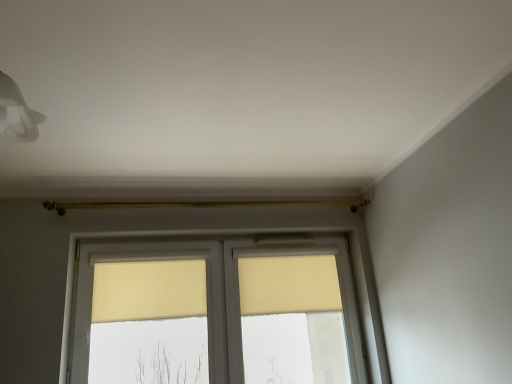
The image size is (512, 384). What do you see at coordinates (216, 313) in the screenshot?
I see `matte yellow window at center` at bounding box center [216, 313].

What do you see at coordinates (149, 290) in the screenshot?
I see `beige fabric curtain at center, the first curtain when ordered from left to right` at bounding box center [149, 290].

I want to click on beige fabric curtain at center, the first curtain when ordered from right to left, so click(x=288, y=285).

Image resolution: width=512 pixels, height=384 pixels. Identify the location of matte yellow window at center. (216, 313).

Could you tell me if beige fabric curtain at center, the first curtain when ordered from right to left, is facing matte yellow window at center?

Yes, beige fabric curtain at center, the first curtain when ordered from right to left, is oriented towards matte yellow window at center.

How far apart are beige fabric curtain at center, the second curtain from the left, and matte yellow window at center?

beige fabric curtain at center, the second curtain from the left, and matte yellow window at center are 6.68 inches apart.

Does beige fabric curtain at center, the first curtain when ordered from right to left, have a larger size compared to matte yellow window at center?

Incorrect, beige fabric curtain at center, the first curtain when ordered from right to left, is not larger than matte yellow window at center.

From a real-world perspective, is beige fabric curtain at center, the first curtain when ordered from right to left, located higher than matte yellow window at center?

Yes, from a real-world perspective, beige fabric curtain at center, the first curtain when ordered from right to left, is over matte yellow window at center

How far apart are beige fabric curtain at center, the first curtain when ordered from left to right, and beige fabric curtain at center, the second curtain from the left?

beige fabric curtain at center, the first curtain when ordered from left to right, is 21.47 inches from beige fabric curtain at center, the second curtain from the left.

Considering the sizes of objects beige fabric curtain at center, the first curtain when ordered from left to right, and beige fabric curtain at center, the first curtain when ordered from right to left, in the image provided, who is shorter, beige fabric curtain at center, the first curtain when ordered from left to right, or beige fabric curtain at center, the first curtain when ordered from right to left,?

beige fabric curtain at center, the first curtain when ordered from left to right.

Between beige fabric curtain at center, acting as the 2th curtain starting from the right, and beige fabric curtain at center, the second curtain from the left, which one is positioned behind?

beige fabric curtain at center, the second curtain from the left.

Can you tell me how much beige fabric curtain at center, acting as the 2th curtain starting from the right, and beige fabric curtain at center, the second curtain from the left, differ in facing direction?

The angle between the facing direction of beige fabric curtain at center, acting as the 2th curtain starting from the right, and the facing direction of beige fabric curtain at center, the second curtain from the left, is 0.00625 degrees.

From a real-world perspective, relative to beige fabric curtain at center, the second curtain from the left, is matte yellow window at center vertically above or below?

matte yellow window at center is situated lower than beige fabric curtain at center, the second curtain from the left, in the real world.

Does matte yellow window at center have a lesser width compared to beige fabric curtain at center, the first curtain when ordered from right to left?

No.

Is matte yellow window at center not close to beige fabric curtain at center, the first curtain when ordered from right to left?

matte yellow window at center is near beige fabric curtain at center, the first curtain when ordered from right to left, not far away.

Does matte yellow window at center lie behind beige fabric curtain at center, the second curtain from the left?

No, matte yellow window at center is closer to the viewer.

Looking at this image, considering the sizes of objects beige fabric curtain at center, the first curtain when ordered from right to left, and beige fabric curtain at center, acting as the 2th curtain starting from the right, in the image provided, who is taller, beige fabric curtain at center, the first curtain when ordered from right to left, or beige fabric curtain at center, acting as the 2th curtain starting from the right,?

Standing taller between the two is beige fabric curtain at center, the first curtain when ordered from right to left.

In the scene shown: Is beige fabric curtain at center, the first curtain when ordered from right to left, surrounding beige fabric curtain at center, acting as the 2th curtain starting from the right?

Actually, beige fabric curtain at center, acting as the 2th curtain starting from the right, is outside beige fabric curtain at center, the first curtain when ordered from right to left.

Which is behind, point (309, 300) or point (136, 267)?

Point (309, 300)

Which object is positioned more to the left, beige fabric curtain at center, the first curtain when ordered from right to left, or beige fabric curtain at center, the first curtain when ordered from left to right?

From the viewer's perspective, beige fabric curtain at center, the first curtain when ordered from left to right, appears more on the left side.

Image resolution: width=512 pixels, height=384 pixels. I want to click on window that appears below the beige fabric curtain at center, the first curtain when ordered from left to right (from a real-world perspective), so click(216, 313).

Does matte yellow window at center turn towards beige fabric curtain at center, the first curtain when ordered from left to right?

Yes, matte yellow window at center is aimed at beige fabric curtain at center, the first curtain when ordered from left to right.

Consider the image. From a real-world perspective, is matte yellow window at center positioned above or below beige fabric curtain at center, acting as the 2th curtain starting from the right?

matte yellow window at center is situated lower than beige fabric curtain at center, acting as the 2th curtain starting from the right, in the real world.

Looking at this image, which object is positioned more to the right, beige fabric curtain at center, acting as the 2th curtain starting from the right, or matte yellow window at center?

From the viewer's perspective, matte yellow window at center appears more on the right side.

Which is nearer, (126, 298) or (281, 277)?

Point (126, 298) appears to be closer to the viewer than point (281, 277).

Considering the sizes of beige fabric curtain at center, the first curtain when ordered from left to right, and matte yellow window at center in the image, is beige fabric curtain at center, the first curtain when ordered from left to right, wider or thinner than matte yellow window at center?

Clearly, beige fabric curtain at center, the first curtain when ordered from left to right, has less width compared to matte yellow window at center.

Considering the positions of objects beige fabric curtain at center, acting as the 2th curtain starting from the right, and matte yellow window at center in the image provided, who is behind, beige fabric curtain at center, acting as the 2th curtain starting from the right, or matte yellow window at center?

beige fabric curtain at center, acting as the 2th curtain starting from the right, is further away from the camera.

Locate an element on the screen. This screenshot has height=384, width=512. window below the beige fabric curtain at center, the first curtain when ordered from right to left (from a real-world perspective) is located at coordinates (216, 313).

You are a GUI agent. You are given a task and a screenshot of the screen. Output one action in this format:
    pyautogui.click(x=<x>, y=<y>)
    Task: Click on the curtain that appears behind the beige fabric curtain at center, the first curtain when ordered from left to right
    This screenshot has height=384, width=512.
    Given the screenshot: What is the action you would take?
    pyautogui.click(x=288, y=285)

Estimate the real-world distances between objects in this image. Which object is further from matte yellow window at center, beige fabric curtain at center, the second curtain from the left, or beige fabric curtain at center, acting as the 2th curtain starting from the right?

beige fabric curtain at center, acting as the 2th curtain starting from the right, is further to matte yellow window at center.

When comparing their distances from beige fabric curtain at center, the first curtain when ordered from left to right, does matte yellow window at center or beige fabric curtain at center, the first curtain when ordered from right to left, seem further?

The object further to beige fabric curtain at center, the first curtain when ordered from left to right, is beige fabric curtain at center, the first curtain when ordered from right to left.

Consider the image. From the image, which object appears to be farther from beige fabric curtain at center, the first curtain when ordered from right to left, beige fabric curtain at center, the first curtain when ordered from left to right, or matte yellow window at center?

beige fabric curtain at center, the first curtain when ordered from left to right.

Estimate the real-world distances between objects in this image. Which object is further from beige fabric curtain at center, acting as the 2th curtain starting from the right, beige fabric curtain at center, the first curtain when ordered from right to left, or matte yellow window at center?

Based on the image, beige fabric curtain at center, the first curtain when ordered from right to left, appears to be further to beige fabric curtain at center, acting as the 2th curtain starting from the right.

Looking at the image, which one is located closer to beige fabric curtain at center, the first curtain when ordered from right to left, matte yellow window at center or beige fabric curtain at center, the first curtain when ordered from left to right?

The object closer to beige fabric curtain at center, the first curtain when ordered from right to left, is matte yellow window at center.

Estimate the real-world distances between objects in this image. Which object is further from matte yellow window at center, beige fabric curtain at center, the first curtain when ordered from left to right, or beige fabric curtain at center, the first curtain when ordered from right to left?

beige fabric curtain at center, the first curtain when ordered from left to right, lies further to matte yellow window at center than the other object.

The height and width of the screenshot is (384, 512). In order to click on window situated between beige fabric curtain at center, acting as the 2th curtain starting from the right, and beige fabric curtain at center, the second curtain from the left, from left to right in this screenshot , I will do `click(216, 313)`.